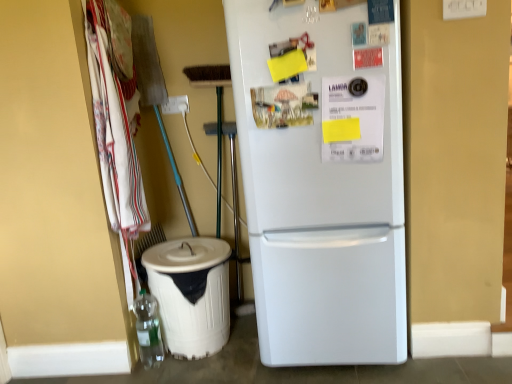
Question: Is white plastic recycling bin at lower left not within white matte refrigerator at center?

Choices:
 (A) no
 (B) yes

Answer: (B)

Question: Is white plastic recycling bin at lower left surrounding white matte refrigerator at center?

Choices:
 (A) no
 (B) yes

Answer: (A)

Question: Is white plastic recycling bin at lower left next to white matte refrigerator at center?

Choices:
 (A) no
 (B) yes

Answer: (A)

Question: From the image's perspective, would you say white plastic recycling bin at lower left is positioned over white matte refrigerator at center?

Choices:
 (A) yes
 (B) no

Answer: (B)

Question: Can you confirm if white plastic recycling bin at lower left is bigger than white matte refrigerator at center?

Choices:
 (A) no
 (B) yes

Answer: (A)

Question: From a real-world perspective, is white cotton towels at left physically located above or below translucent plastic bottle at lower left?

Choices:
 (A) above
 (B) below

Answer: (A)

Question: Relative to translucent plastic bottle at lower left, is white cotton towels at left in front or behind?

Choices:
 (A) front
 (B) behind

Answer: (A)

Question: Do you think white cotton towels at left is within translucent plastic bottle at lower left, or outside of it?

Choices:
 (A) outside
 (B) inside

Answer: (A)

Question: Considering the positions of white cotton towels at left and translucent plastic bottle at lower left in the image, is white cotton towels at left wider or thinner than translucent plastic bottle at lower left?

Choices:
 (A) wide
 (B) thin

Answer: (A)

Question: Considering the relative positions of white matte refrigerator at center and white cotton towels at left in the image provided, is white matte refrigerator at center to the left or to the right of white cotton towels at left?

Choices:
 (A) right
 (B) left

Answer: (A)

Question: Considering the positions of white matte refrigerator at center and white cotton towels at left in the image, is white matte refrigerator at center wider or thinner than white cotton towels at left?

Choices:
 (A) wide
 (B) thin

Answer: (A)

Question: Considering the positions of point (377, 188) and point (131, 160), is point (377, 188) closer or farther from the camera than point (131, 160)?

Choices:
 (A) closer
 (B) farther

Answer: (A)

Question: Looking at the image, does white matte refrigerator at center seem bigger or smaller compared to white cotton towels at left?

Choices:
 (A) big
 (B) small

Answer: (A)

Question: In terms of size, does translucent plastic bottle at lower left appear bigger or smaller than white cotton towels at left?

Choices:
 (A) small
 (B) big

Answer: (A)

Question: In terms of width, does translucent plastic bottle at lower left look wider or thinner when compared to white cotton towels at left?

Choices:
 (A) thin
 (B) wide

Answer: (A)